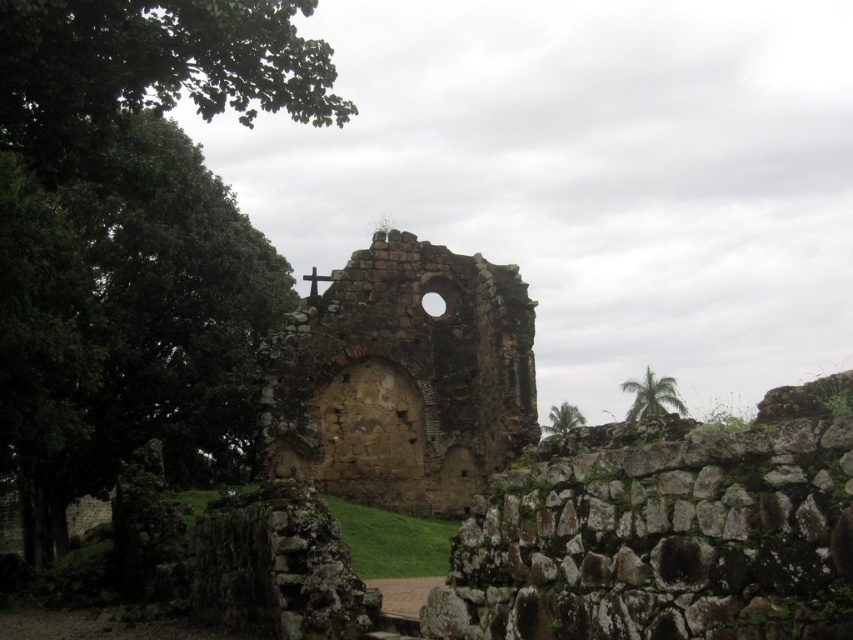
Consider the image. You are standing at the center of the ruins and looking towards the cross above the arched opening. Which tree, the green leafy tree at upper left or the green leafy palm at upper right, is positioned to your left side?

The green leafy tree at upper left is positioned to your left side since it is to the left of the green leafy palm at upper right.

You are standing at the center of the ruins and notice a point marked at coordinates (402, 378). What can you find at that exact location?

At point (402, 378) lies brown stone ruins at center.